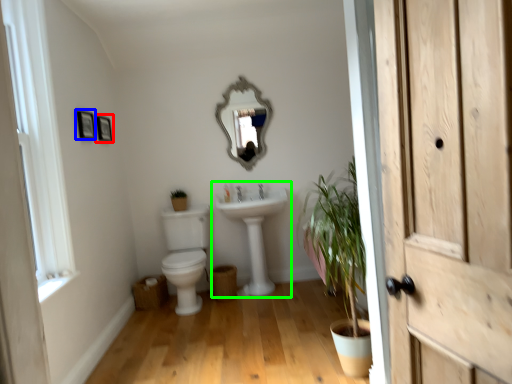
Question: Which object is positioned farthest from picture frame (highlighted by a red box)? Select from picture frame (highlighted by a blue box) and sink (highlighted by a green box).

Choices:
 (A) picture frame
 (B) sink

Answer: (B)